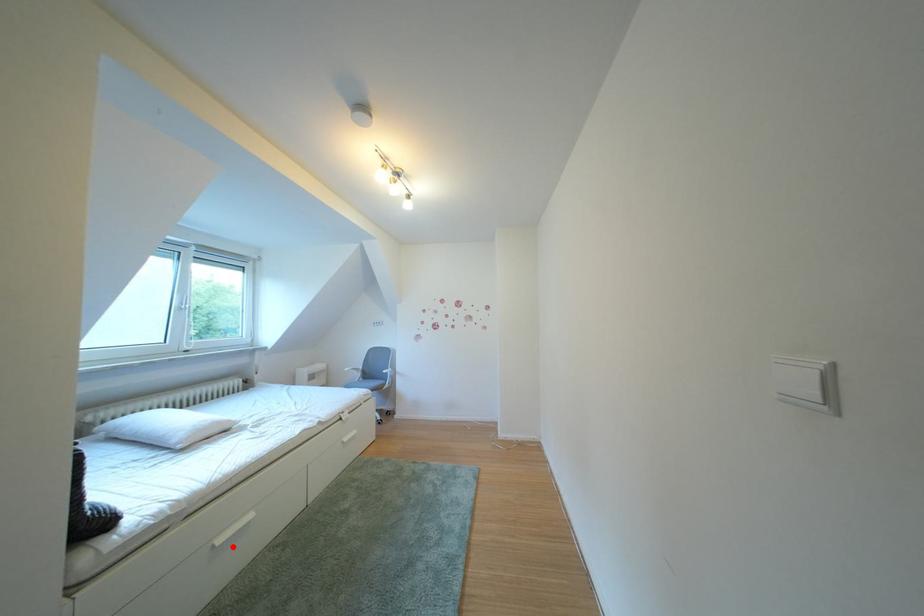
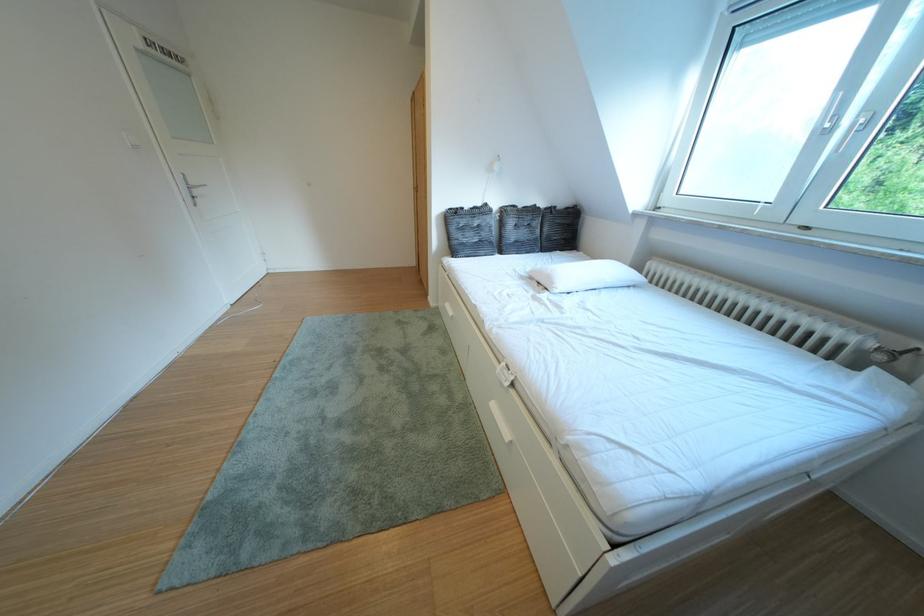
In the second image, find the point that corresponds to the highlighted location in the first image.

(460, 310)